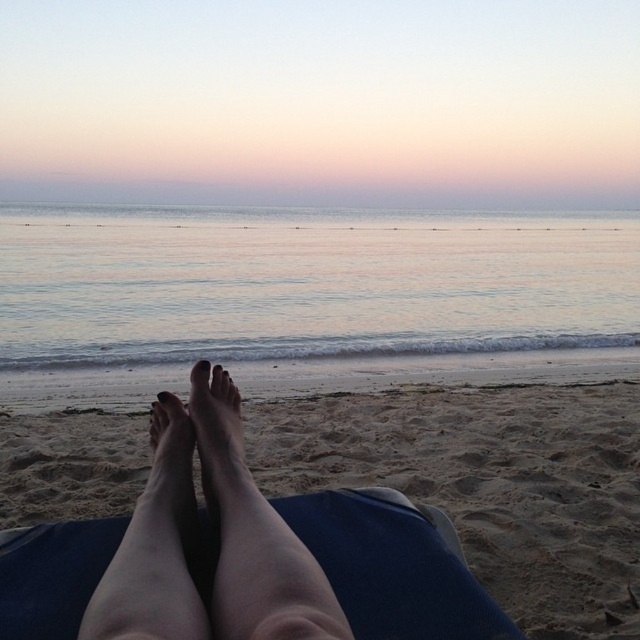
Question: Is smooth water at center to the right of sandy beach at lower center from the viewer's perspective?

Choices:
 (A) no
 (B) yes

Answer: (B)

Question: Which object is farther from the camera taking this photo?

Choices:
 (A) blue fabric at lower center
 (B) smooth skin feet at lower center
 (C) smooth skin legs at center

Answer: (A)

Question: Among these objects, which one is nearest to the camera?

Choices:
 (A) smooth skin legs at center
 (B) pastel pink sky at upper center
 (C) smooth water at center
 (D) smooth skin leg at lower center

Answer: (A)

Question: Which point is closer to the camera?

Choices:
 (A) [x=236, y=500]
 (B) [x=195, y=616]
 (C) [x=202, y=362]
 (D) [x=584, y=186]

Answer: (B)

Question: Is smooth skin feet at lower center below matte skin toe at center?

Choices:
 (A) yes
 (B) no

Answer: (A)

Question: Is smooth skin legs at center to the right of pastel pink sky at upper center from the viewer's perspective?

Choices:
 (A) no
 (B) yes

Answer: (B)